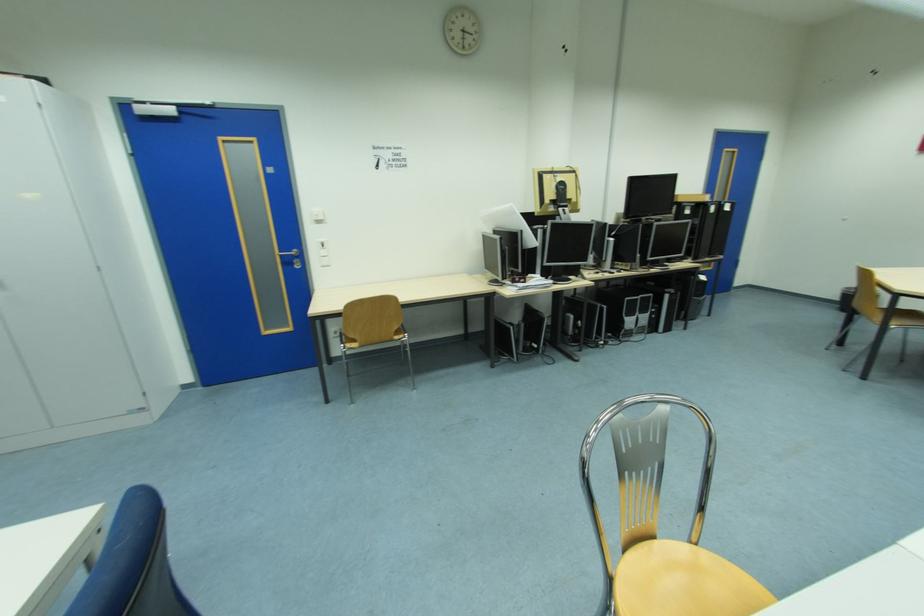
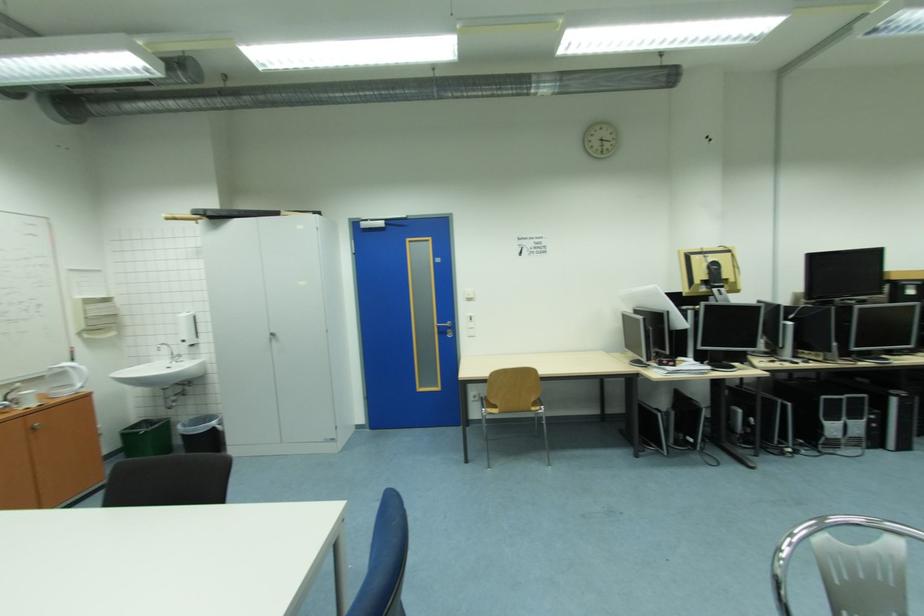
In the second image, find the point that corresponds to (x=325, y=223) in the first image.

(477, 301)